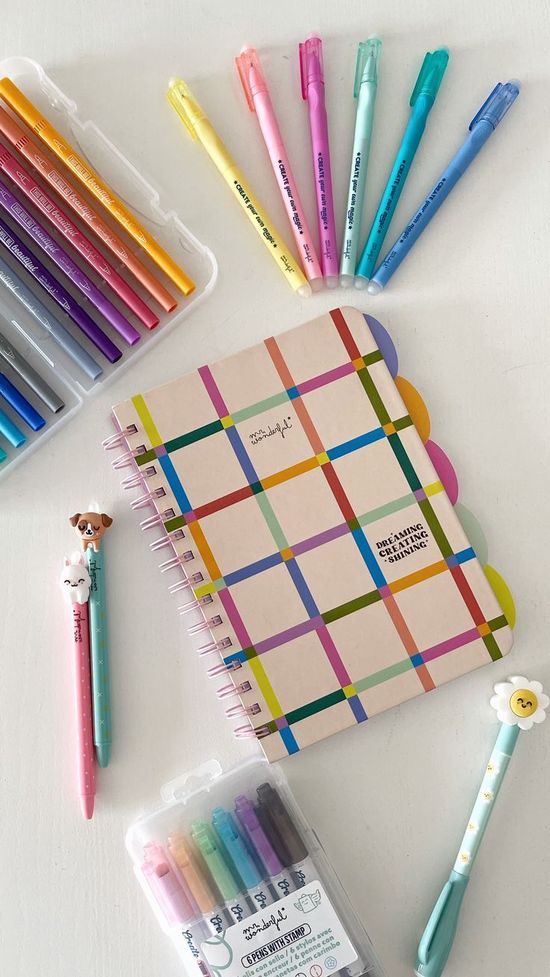
This screenshot has width=550, height=977. Find the location of `loose pens`. loose pens is located at coordinates (245, 211), (288, 198), (321, 196), (354, 185), (397, 189), (437, 200), (101, 694), (82, 695), (475, 828).